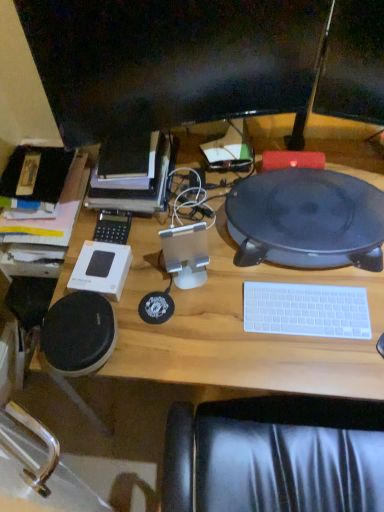
This screenshot has width=384, height=512. What are the coordinates of `empty space that is ontop of hardcover book at upper left (from a real-world perspective)` in the screenshot? It's located at (128, 153).